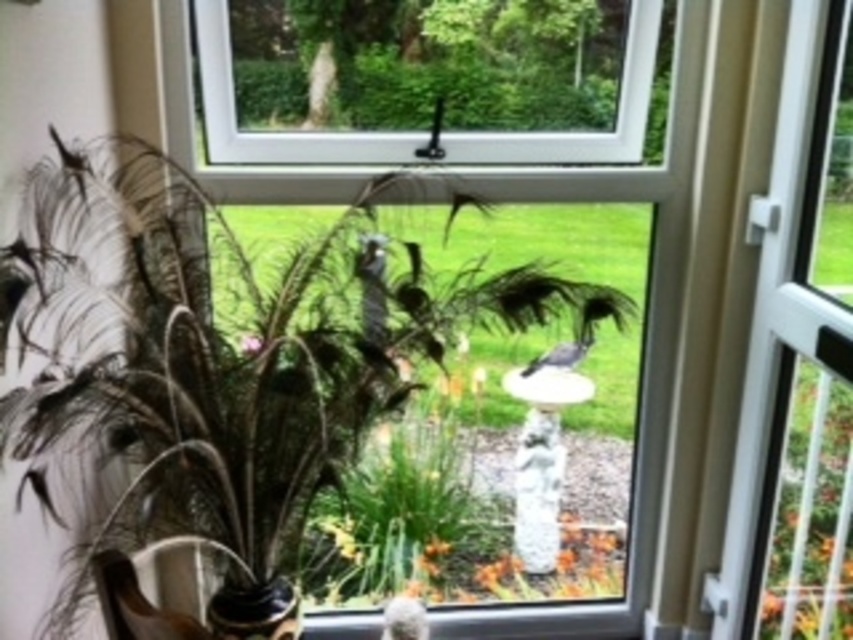
You are arranging flowers for a party and need to know which object has more space. Which is bigger, the feathered vase at left or the green leafy plant at lower right?

The feathered vase at left is larger in size than the green leafy plant at lower right, so the feathered vase at left has more space.

You are standing at the point marked at (x=364, y=531) in the room. The window is directly in front of you. If you walk straight towards the window, will you be able to see the orange flowers in the garden through the window?

Yes, because the point marked at (x=364, y=531) is 7.52 feet away from the window, so walking straight towards the window will bring you close enough to see the orange flowers through it.